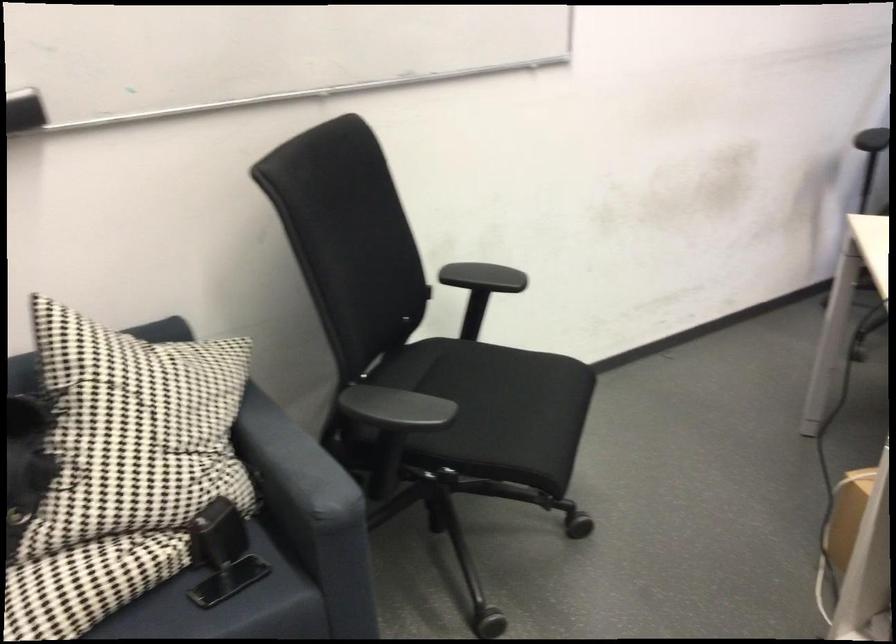
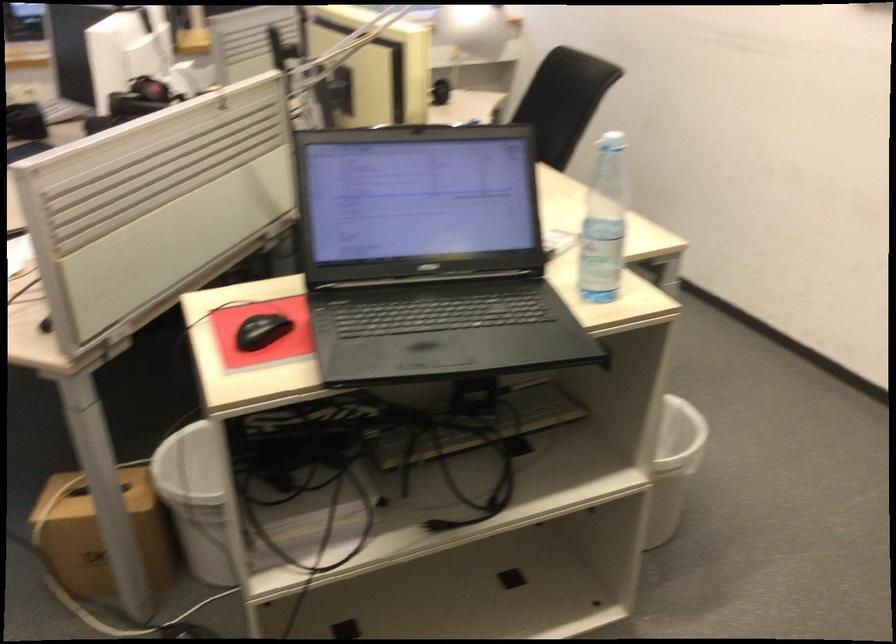
First-person continuous shooting, in which direction is the camera rotating?

The rotation direction of the camera is right-down.